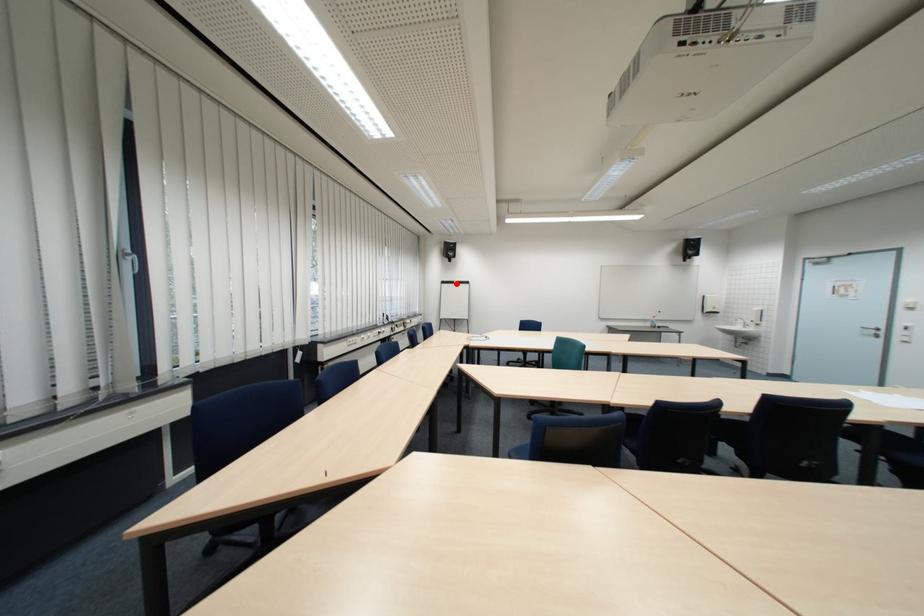
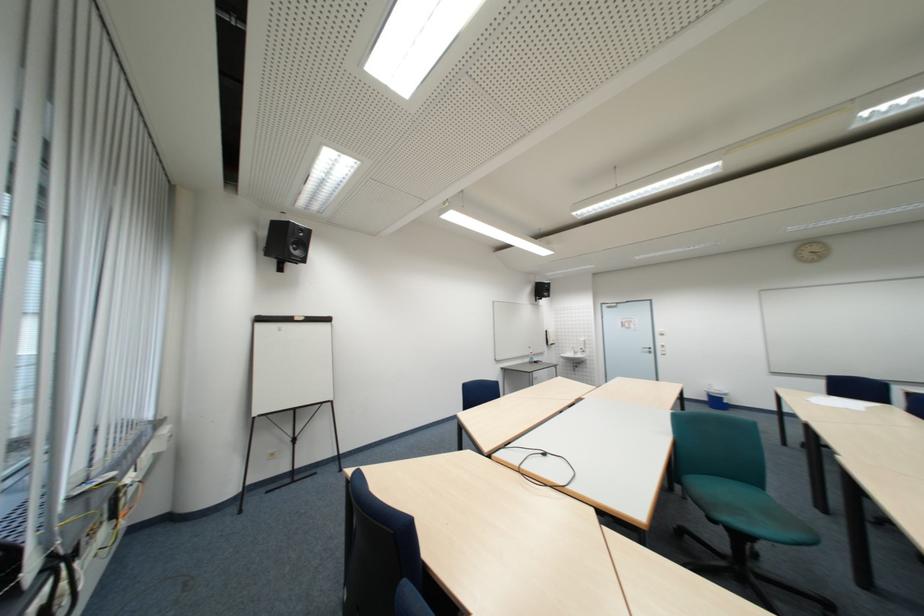
Locate, in the second image, the point that corresponds to the highlighted location in the first image.

(273, 321)